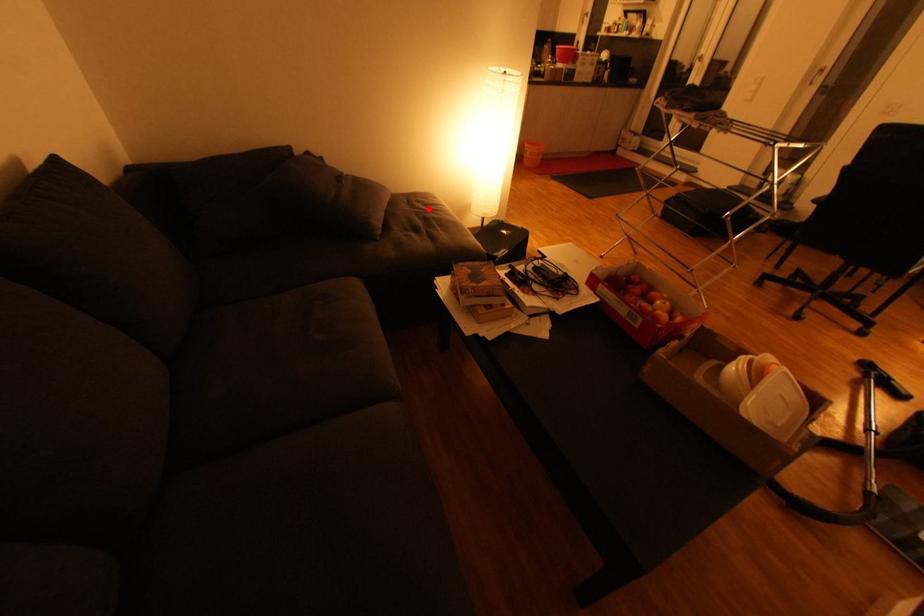
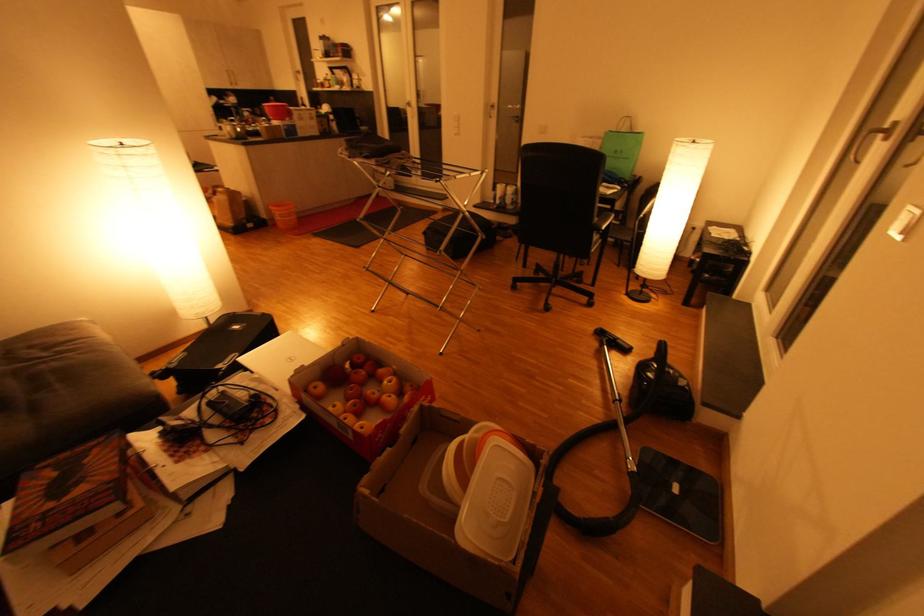
Locate, in the second image, the point that corresponds to the highlighted location in the first image.

(47, 355)